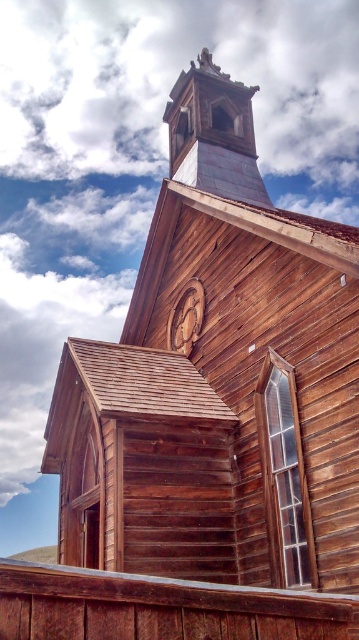
Question: Which of the following is the closest to the observer?

Choices:
 (A) wooden steeple at upper center
 (B) wooden carving at center

Answer: (B)

Question: Is wooden steeple at upper center positioned at the back of wooden carving at center?

Choices:
 (A) no
 (B) yes

Answer: (B)

Question: From the image, what is the correct spatial relationship of wooden steeple at upper center in relation to wooden carving at center?

Choices:
 (A) below
 (B) above

Answer: (B)

Question: Which point appears farthest from the camera in this image?

Choices:
 (A) (175, 301)
 (B) (183, 154)

Answer: (B)

Question: Can you confirm if wooden steeple at upper center is positioned to the left of wooden carving at center?

Choices:
 (A) yes
 (B) no

Answer: (B)

Question: Which point is closer to the camera?

Choices:
 (A) (227, 77)
 (B) (179, 314)

Answer: (B)